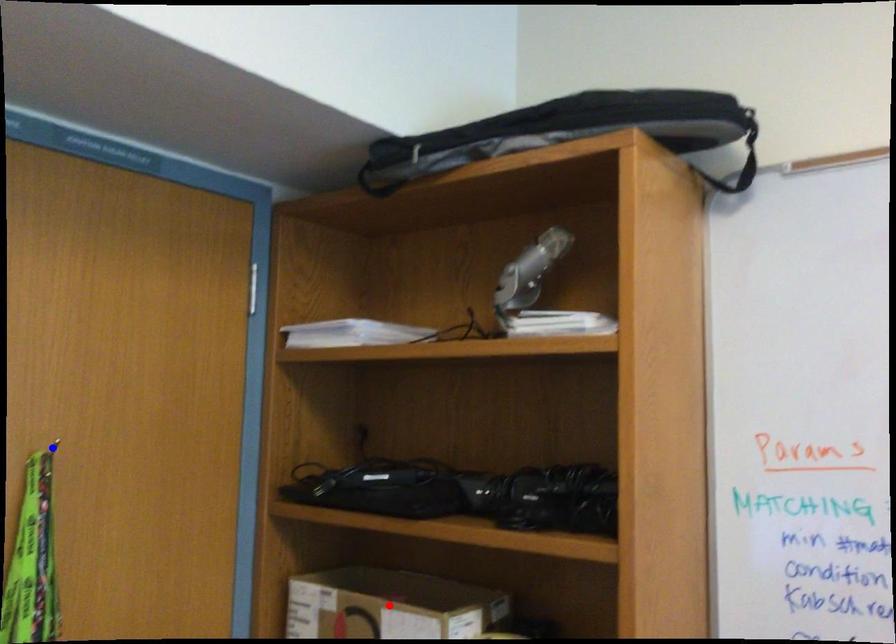
Question: Which of the two points in the image is closer to the camera?

Choices:
 (A) Blue point is closer.
 (B) Red point is closer.

Answer: (A)